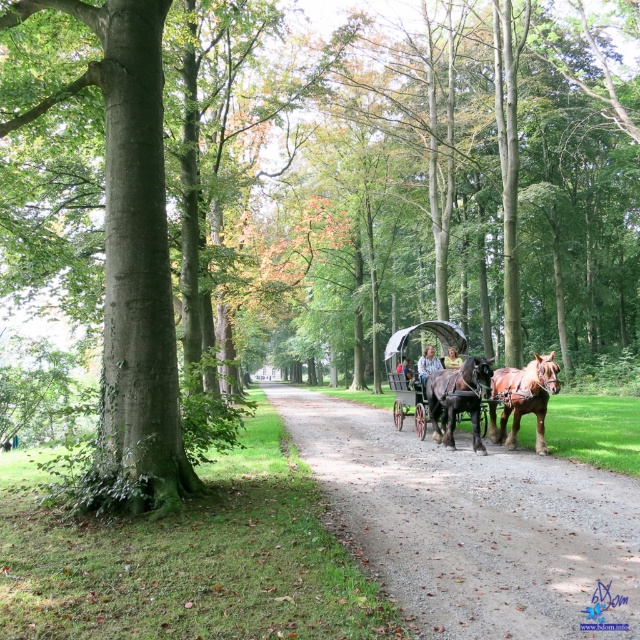
Question: Which of the following is the closest to the observer?

Choices:
 (A) light brown leather jacket at center
 (B) light blue denim jacket at center
 (C) brown glossy horse at center
 (D) brown glossy horse at right

Answer: (C)

Question: Among these objects, which one is farthest from the camera?

Choices:
 (A) light brown leather jacket at center
 (B) brown glossy horse at center

Answer: (A)

Question: Which of the following is the closest to the observer?

Choices:
 (A) click(452, 396)
 (B) click(406, 372)
 (C) click(412, 388)

Answer: (A)

Question: Can you confirm if gravel path at center is positioned below brown glossy horse at center?

Choices:
 (A) yes
 (B) no

Answer: (A)

Question: Is shiny black carriage at center above light brown leather jacket at center?

Choices:
 (A) yes
 (B) no

Answer: (A)

Question: Can you confirm if shiny black carriage at center is positioned to the right of light blue denim jacket at center?

Choices:
 (A) no
 (B) yes

Answer: (B)